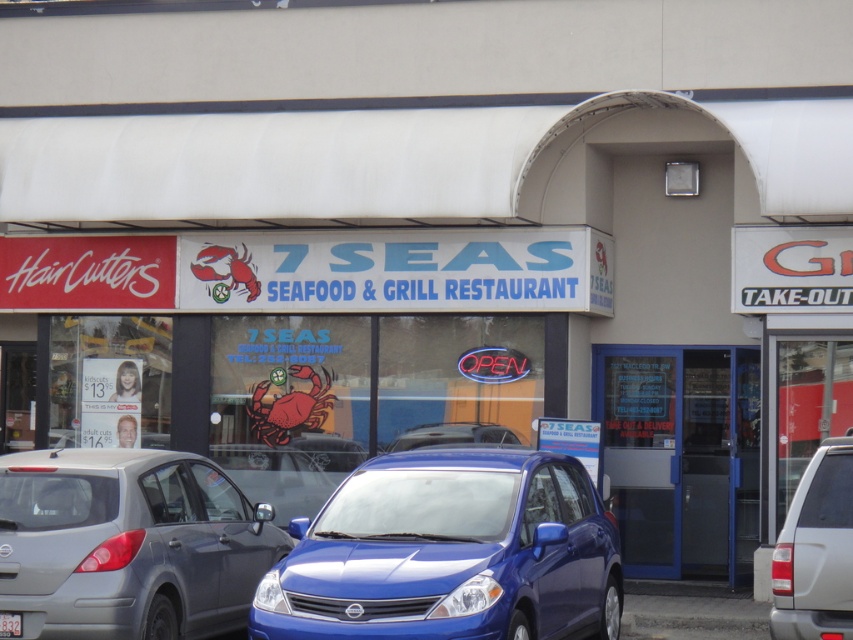
Measure the distance between blue glossy sedan at center and camera.

blue glossy sedan at center and camera are 33.23 feet apart from each other.

This screenshot has width=853, height=640. What are the coordinates of `blue glossy sedan at center` in the screenshot? It's located at (450, 552).

This screenshot has height=640, width=853. What are the coordinates of `blue glossy sedan at center` in the screenshot? It's located at (450, 552).

In the scene shown: Which of these two, silver metallic suv at lower right or white plastic license plate at center, stands shorter?

Standing shorter between the two is white plastic license plate at center.

Who is positioned more to the left, silver metallic suv at lower right or white plastic license plate at center?

white plastic license plate at center is more to the left.

Between point (827, 545) and point (16, 625), which one is positioned behind?

Positioned behind is point (16, 625).

This screenshot has width=853, height=640. Find the location of `silver metallic suv at lower right`. silver metallic suv at lower right is located at coordinates (816, 550).

Does matte gray sedan at center have a greater height compared to blue matte car at center?

Yes, matte gray sedan at center is taller than blue matte car at center.

I want to click on matte gray sedan at center, so click(128, 545).

Is point (115, 614) positioned in front of point (444, 444)?

Yes, point (115, 614) is closer to viewer.

This screenshot has width=853, height=640. In order to click on matte gray sedan at center in this screenshot , I will do `click(128, 545)`.